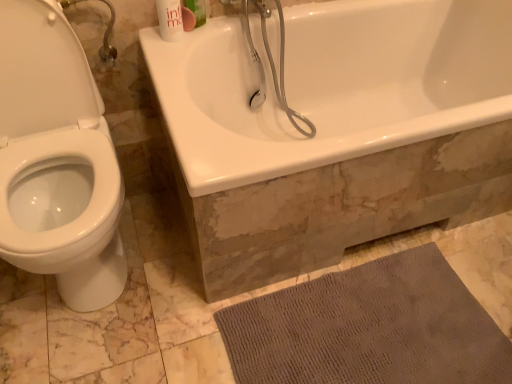
Question: Can you confirm if gray textured bath mat at lower right is taller than white glossy bathtub at upper center?

Choices:
 (A) yes
 (B) no

Answer: (B)

Question: From a real-world perspective, is gray textured bath mat at lower right physically below white glossy bathtub at upper center?

Choices:
 (A) no
 (B) yes

Answer: (B)

Question: Could you tell me if gray textured bath mat at lower right is turned towards white glossy bathtub at upper center?

Choices:
 (A) no
 (B) yes

Answer: (A)

Question: Is gray textured bath mat at lower right located outside white glossy bathtub at upper center?

Choices:
 (A) yes
 (B) no

Answer: (A)

Question: Considering the relative positions of gray textured bath mat at lower right and white glossy bathtub at upper center in the image provided, is gray textured bath mat at lower right to the right of white glossy bathtub at upper center from the viewer's perspective?

Choices:
 (A) yes
 (B) no

Answer: (B)

Question: In terms of width, does white glossy mouthwash at upper center, which is the second mouthwash in left-to-right order, look wider or thinner when compared to gray textured bath mat at lower right?

Choices:
 (A) thin
 (B) wide

Answer: (A)

Question: From a real-world perspective, relative to gray textured bath mat at lower right, is white glossy mouthwash at upper center, which is the second mouthwash in left-to-right order, vertically above or below?

Choices:
 (A) above
 (B) below

Answer: (A)

Question: Is white glossy mouthwash at upper center, which is counted as the first mouthwash, starting from the right, to the left or to the right of gray textured bath mat at lower right in the image?

Choices:
 (A) right
 (B) left

Answer: (B)

Question: In terms of height, does white glossy mouthwash at upper center, which is counted as the first mouthwash, starting from the right, look taller or shorter compared to gray textured bath mat at lower right?

Choices:
 (A) short
 (B) tall

Answer: (B)

Question: In terms of height, does white glossy bathtub at upper center look taller or shorter compared to white glossy mouthwash at upper center, the first mouthwash when ordered from left to right?

Choices:
 (A) short
 (B) tall

Answer: (B)

Question: From a real-world perspective, is white glossy bathtub at upper center above or below white glossy mouthwash at upper center, the 2th mouthwash positioned from the right?

Choices:
 (A) above
 (B) below

Answer: (B)

Question: Looking at their shapes, would you say white glossy bathtub at upper center is wider or thinner than white glossy mouthwash at upper center, the first mouthwash when ordered from left to right?

Choices:
 (A) thin
 (B) wide

Answer: (B)

Question: Is point (294, 97) closer or farther from the camera than point (167, 36)?

Choices:
 (A) farther
 (B) closer

Answer: (A)

Question: In terms of width, does white glossy bathtub at upper center look wider or thinner when compared to white glossy mouthwash at upper center, which is the second mouthwash in left-to-right order?

Choices:
 (A) wide
 (B) thin

Answer: (A)

Question: From a real-world perspective, is white glossy bathtub at upper center positioned above or below white glossy mouthwash at upper center, which is counted as the first mouthwash, starting from the right?

Choices:
 (A) below
 (B) above

Answer: (A)